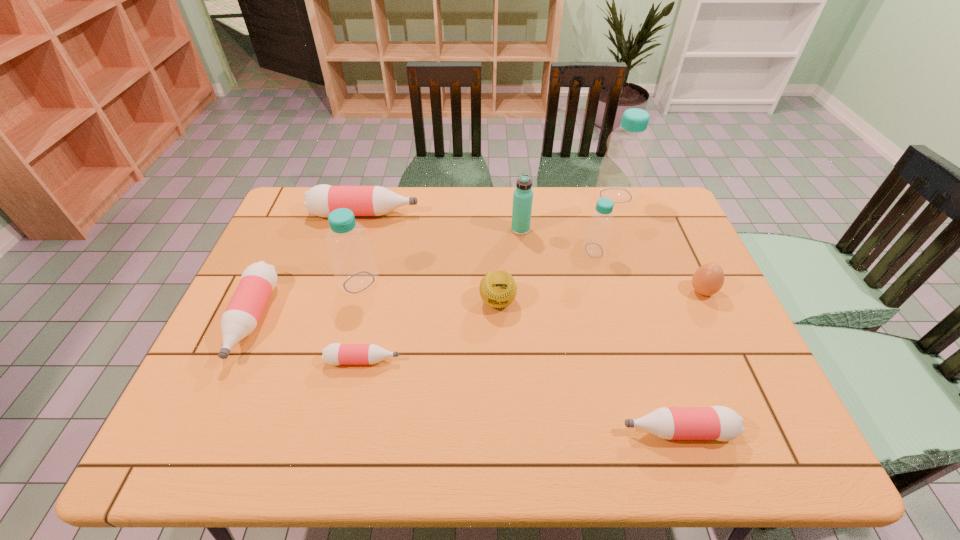
Identify the location of free space at the right edge. This screenshot has height=540, width=960. (667, 321).

Identify the location of free space at the near left corner. The height and width of the screenshot is (540, 960). (192, 422).

In the image, there is a desktop. In order to click on free space at the far right corner in this screenshot , I will do `click(659, 192)`.

Where is `vacant region between the tallest object and the sixth tallest bottle`? The width and height of the screenshot is (960, 540). vacant region between the tallest object and the sixth tallest bottle is located at coordinates (646, 313).

Identify the location of free space between the boiled egg and the thermos bottle. (612, 260).

Locate an element on the screen. The width and height of the screenshot is (960, 540). free space between the aqua thermos bottle and the second shortest object is located at coordinates (599, 330).

Locate an element on the screen. unoccupied position between the brown boiled egg and the fifth tallest bottle is located at coordinates (477, 305).

Locate an element on the screen. free space between the third tallest bottle and the second biggest pink bottle is located at coordinates (423, 285).

Locate an element on the screen. The image size is (960, 540). free space that is in between the biggest blue bottle and the aqua thermos bottle is located at coordinates 568,213.

Locate an element on the screen. This screenshot has height=540, width=960. free point between the fourth shortest bottle and the fifth shortest bottle is located at coordinates (479, 232).